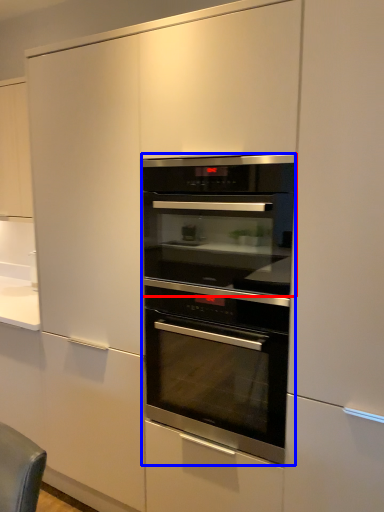
Question: Which object appears farthest to the camera in this image, oven (highlighted by a red box) or oven (highlighted by a blue box)?

Choices:
 (A) oven
 (B) oven

Answer: (B)